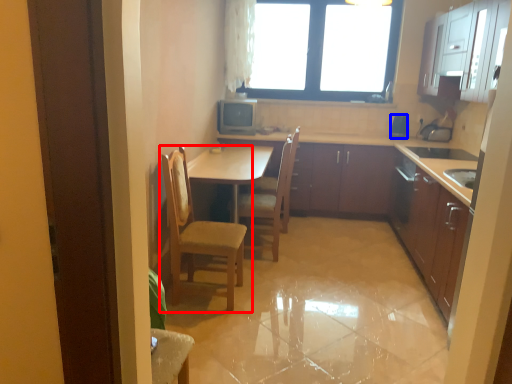
Question: Which of the following is the closest to the observer, chair (highlighted by a red box) or appliance (highlighted by a blue box)?

Choices:
 (A) chair
 (B) appliance

Answer: (A)